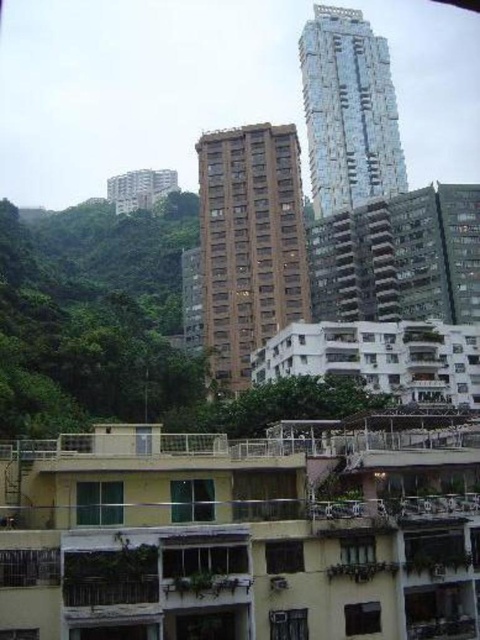
You are an urban planner analyzing the layout of this area. You need to determine which building takes up more area in the image between the brown textured building at center and the glassy reflective building at upper center. Which one is larger?

The glassy reflective building at upper center occupies more space than the brown textured building at center according to the description.

You are a city planner analyzing the urban layout. You observe the brown textured building at center and the glassy reflective building at upper center. Which of these two buildings has a narrower structure?

The brown textured building at center has a lesser width compared to the glassy reflective building at upper center, so it is narrower.